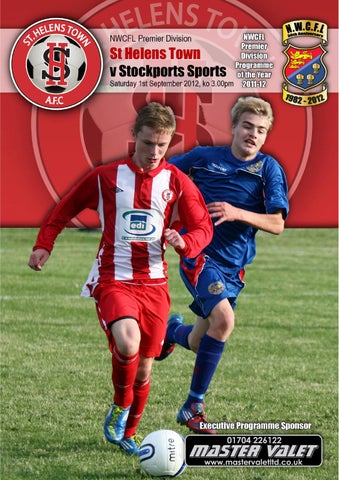
You are a GUI agent. You are given a task and a screenshot of the screen. Output one action in this format:
    pyautogui.click(x=<x>, y=<y>)
    Task: Click on the little gold trophies
    
    Given the screenshot: What is the action you would take?
    pyautogui.click(x=298, y=75), pyautogui.click(x=309, y=76), pyautogui.click(x=316, y=65)